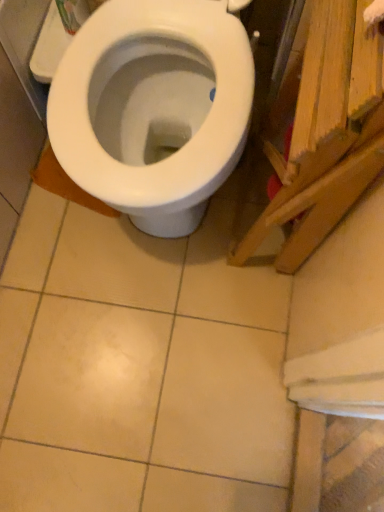
Question: From a real-world perspective, relative to wooden plank at right, is white glossy bidet at center vertically above or below?

Choices:
 (A) above
 (B) below

Answer: (B)

Question: From their relative heights in the image, would you say white glossy bidet at center is taller or shorter than wooden plank at right?

Choices:
 (A) tall
 (B) short

Answer: (B)

Question: Is white glossy bidet at center spatially inside wooden plank at right, or outside of it?

Choices:
 (A) inside
 (B) outside

Answer: (B)

Question: From a real-world perspective, is wooden plank at right physically located above or below white glossy bidet at center?

Choices:
 (A) above
 (B) below

Answer: (A)

Question: Which is correct: wooden plank at right is inside white glossy bidet at center, or outside of it?

Choices:
 (A) inside
 (B) outside

Answer: (B)

Question: Considering the positions of point (311, 79) and point (162, 206), is point (311, 79) closer or farther from the camera than point (162, 206)?

Choices:
 (A) farther
 (B) closer

Answer: (B)

Question: From the image's perspective, is wooden plank at right located above or below white glossy bidet at center?

Choices:
 (A) below
 (B) above

Answer: (A)